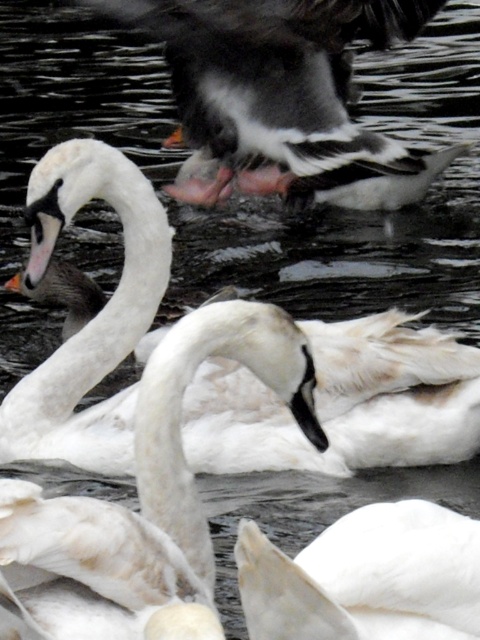
Question: Is white feathered swan at upper left thinner than white matte swan at center?

Choices:
 (A) yes
 (B) no

Answer: (B)

Question: Is white feathered swan at upper left to the right of black glossy duck at upper center from the viewer's perspective?

Choices:
 (A) yes
 (B) no

Answer: (B)

Question: Does white feathered swan at upper left have a greater width compared to black glossy duck at upper center?

Choices:
 (A) yes
 (B) no

Answer: (B)

Question: Considering the real-world distances, which object is closest to the white feathered swan at center?

Choices:
 (A) black glossy duck at upper center
 (B) white matte swan at center
 (C) white feathered swan at upper left

Answer: (B)

Question: Which of the following is the closest to the observer?

Choices:
 (A) white feathered swan at center
 (B) white feathered swan at upper left
 (C) black glossy duck at upper center

Answer: (A)

Question: Which of the following is the closest to the observer?

Choices:
 (A) white feathered swan at upper left
 (B) white matte swan at center
 (C) black glossy duck at upper center

Answer: (B)